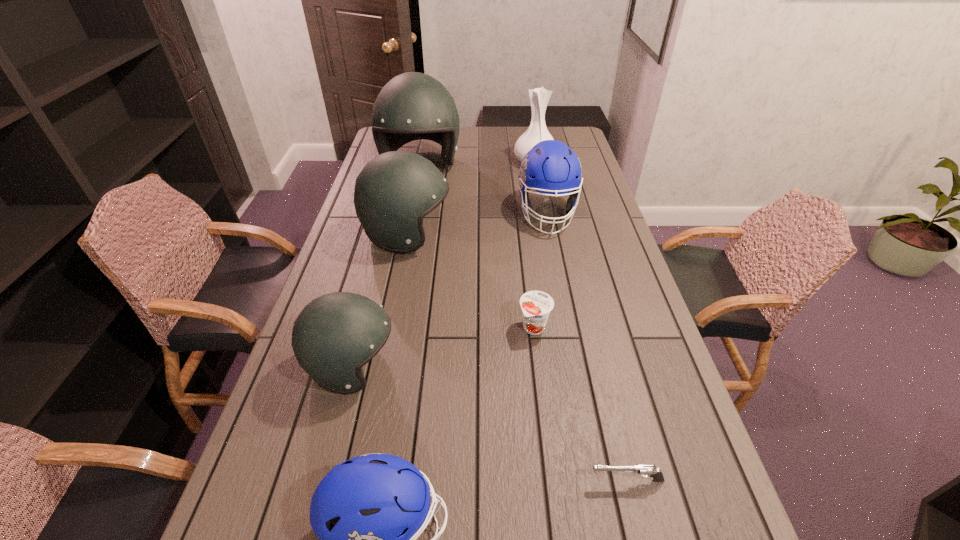
You are a GUI agent. You are given a task and a screenshot of the screen. Output one action in this format:
    pyautogui.click(x=<x>, y=<y>)
    Task: Click on the free area in between the biggest green football helmet and the nearest green football helmet
    This screenshot has height=540, width=960.
    Given the screenshot: What is the action you would take?
    click(386, 266)

Locate an element on the screen. Image resolution: width=960 pixels, height=540 pixels. vacant point located between the vase and the farthest football helmet is located at coordinates (477, 164).

This screenshot has height=540, width=960. I want to click on free space that is in between the nearest green football helmet and the second biggest green football helmet, so click(x=380, y=301).

You are a GUI agent. You are given a task and a screenshot of the screen. Output one action in this format:
    pyautogui.click(x=<x>, y=<y>)
    Task: Click on the object identified as the sixth closest to the shortest object
    This screenshot has width=960, height=540.
    Given the screenshot: What is the action you would take?
    pyautogui.click(x=412, y=106)

At what (x,y) coordinates should I click in order to perform the action: click on object that is the seventh nearest to the second nearest green football helmet. Please return your answer as a coordinate pair (x, y). Looking at the image, I should click on (645, 470).

Select which football helmet appears as the fourth closest to the left blue football helmet. Please provide its 2D coordinates. Your answer should be formatted as a tuple, i.e. [(x, y)], where the tuple contains the x and y coordinates of a point satisfying the conditions above.

[(412, 106)]

Identify the location of football helmet that is the third nearest to the second biggest green football helmet. The height and width of the screenshot is (540, 960). (335, 335).

This screenshot has height=540, width=960. Find the location of `the second closest green football helmet to the tallest object`. the second closest green football helmet to the tallest object is located at coordinates (335, 335).

Identify which green football helmet is the nearest to the smaller blue football helmet. Please provide its 2D coordinates. Your answer should be formatted as a tuple, i.e. [(x, y)], where the tuple contains the x and y coordinates of a point satisfying the conditions above.

[(335, 335)]

This screenshot has width=960, height=540. In order to click on vacant area that satisfies the following two spatial constraints: 1. on the front side of the white vase; 2. at the face opening of the second biggest green football helmet in this screenshot , I will do `click(548, 235)`.